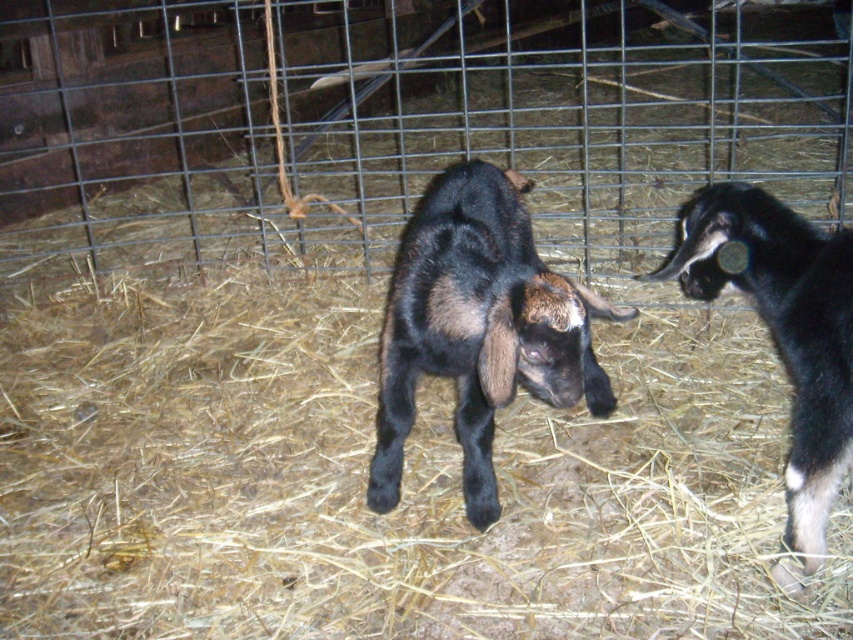
Question: Does brown straw at center appear over black soft fur goat at center?

Choices:
 (A) yes
 (B) no

Answer: (B)

Question: Estimate the real-world distances between objects in this image. Which object is farther from the black soft fur goat at center?

Choices:
 (A) black matte goat at right
 (B) brown straw at center

Answer: (B)

Question: Is brown straw at center above black soft fur goat at center?

Choices:
 (A) no
 (B) yes

Answer: (A)

Question: Which object is the closest to the black soft fur goat at center?

Choices:
 (A) black matte goat at right
 (B) brown straw at center

Answer: (A)

Question: Considering the relative positions of brown straw at center and black soft fur goat at center in the image provided, where is brown straw at center located with respect to black soft fur goat at center?

Choices:
 (A) right
 (B) left

Answer: (B)

Question: Which point is closer to the camera?

Choices:
 (A) (486, 289)
 (B) (62, 404)

Answer: (A)